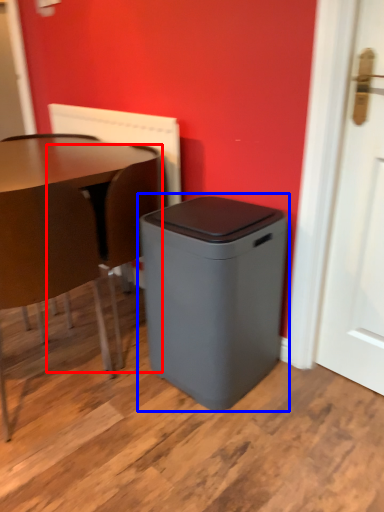
Question: Which object is further to the camera taking this photo, swivel chair (highlighted by a red box) or waste container (highlighted by a blue box)?

Choices:
 (A) swivel chair
 (B) waste container

Answer: (A)